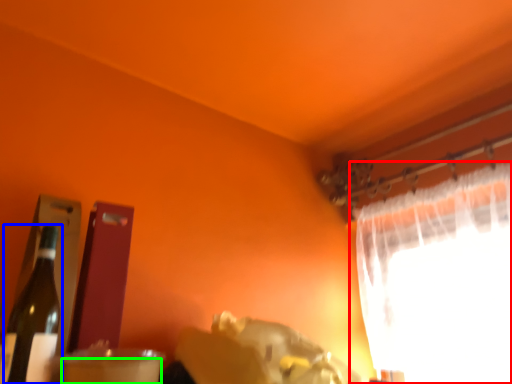
Question: Which object is positioned closest to curtain (highlighted by a red box)? Select from bottle (highlighted by a blue box) and drinking straw (highlighted by a green box).

Choices:
 (A) bottle
 (B) drinking straw

Answer: (B)